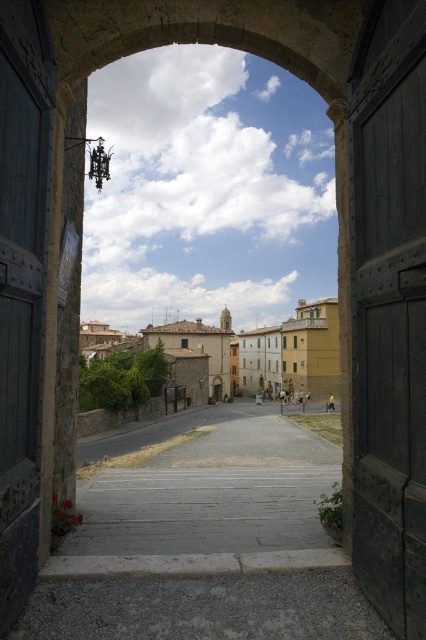
Question: Can you confirm if gray stone alley at center is positioned to the left of dark wood door at left?

Choices:
 (A) yes
 (B) no

Answer: (B)

Question: Which object is positioned farthest from the dark wood door at left?

Choices:
 (A) gray stone alley at center
 (B) beige stone buildings at center

Answer: (B)

Question: Does dark wood door at right appear on the left side of beige stone buildings at center?

Choices:
 (A) yes
 (B) no

Answer: (B)

Question: Is dark wood door at left positioned at the back of beige stone buildings at center?

Choices:
 (A) yes
 (B) no

Answer: (B)

Question: Among these objects, which one is farthest from the camera?

Choices:
 (A) dark wood door at left
 (B) dark wood door at right
 (C) beige stone buildings at center

Answer: (C)

Question: Among these points, which one is farthest from the camera?

Choices:
 (A) 285,490
 (B) 357,419

Answer: (A)